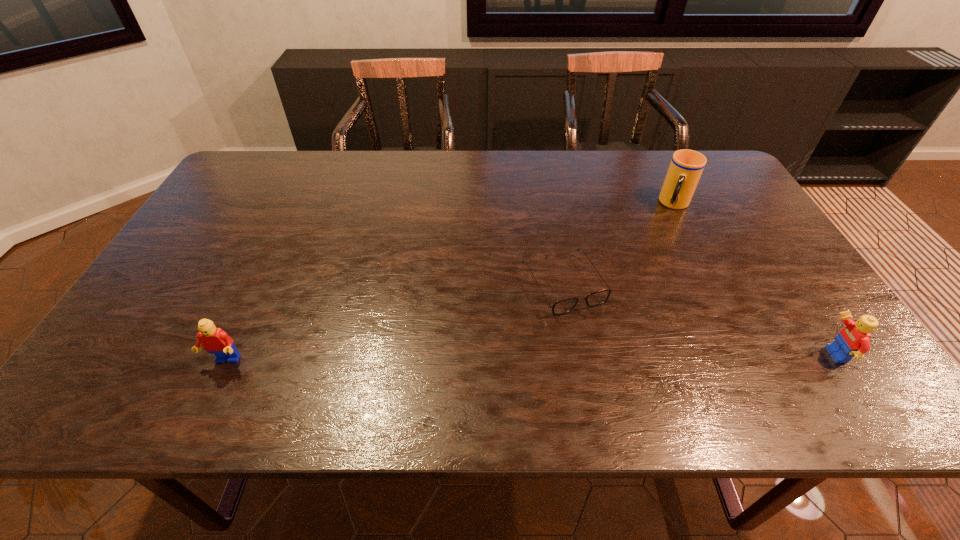
The height and width of the screenshot is (540, 960). I want to click on object that is the second closest to the leftmost object, so click(686, 167).

Where is `object that stands as the second closest to the cup`? The width and height of the screenshot is (960, 540). object that stands as the second closest to the cup is located at coordinates (852, 342).

Find the location of a particular element. The width and height of the screenshot is (960, 540). free space that satisfies the following two spatial constraints: 1. on the front side of the cup; 2. on the face of the right Lego is located at coordinates click(752, 355).

Find the location of a particular element. Image resolution: width=960 pixels, height=540 pixels. vacant region that satisfies the following two spatial constraints: 1. on the front side of the rightmost object; 2. on the face of the farthest object is located at coordinates (752, 355).